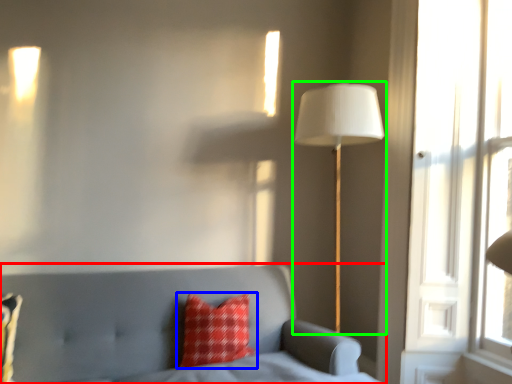
Question: Which object is positioned farthest from furniture (highlighted by a red box)? Select from pillow (highlighted by a blue box) and lamp (highlighted by a green box).

Choices:
 (A) pillow
 (B) lamp

Answer: (B)